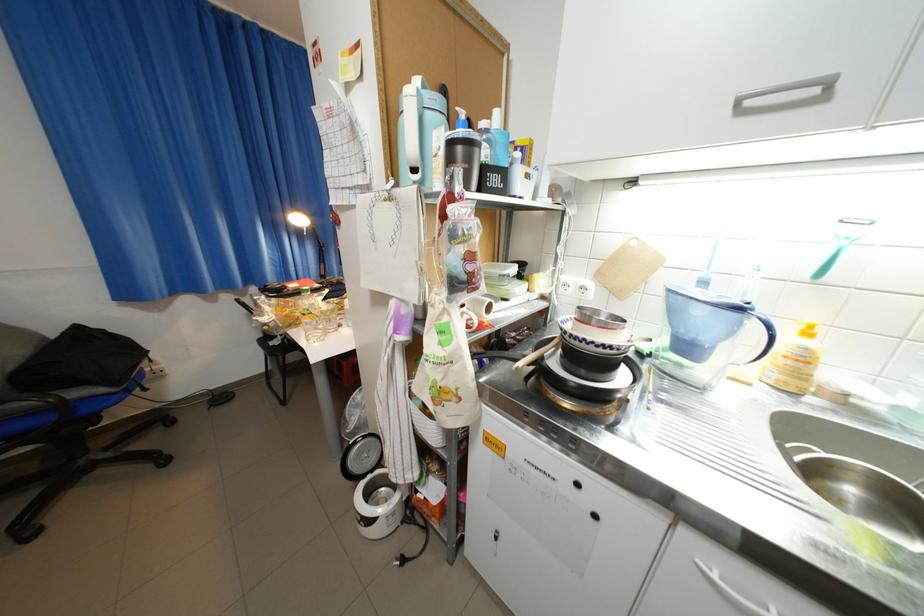
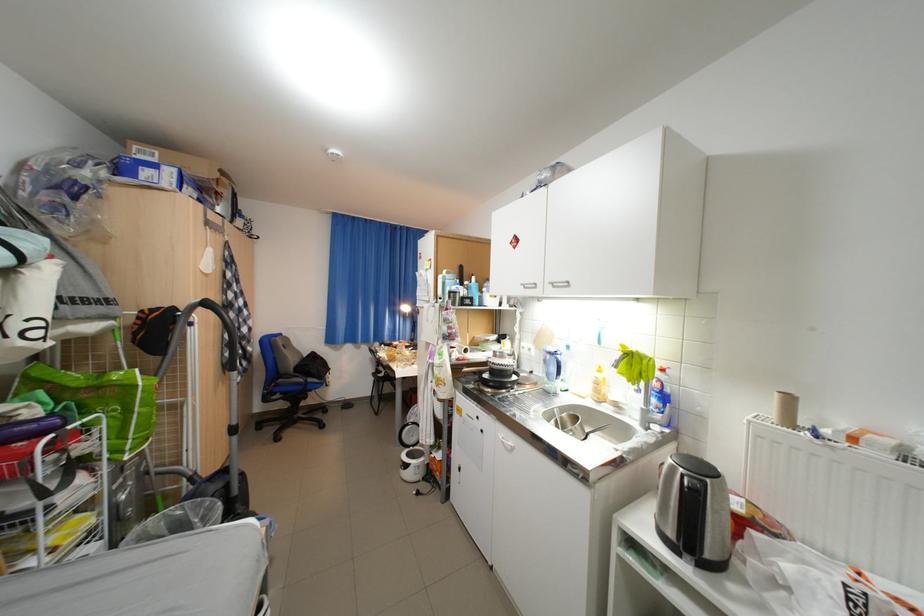
In the second image, find the point that corresponds to pixel 761 386 in the first image.

(594, 399)